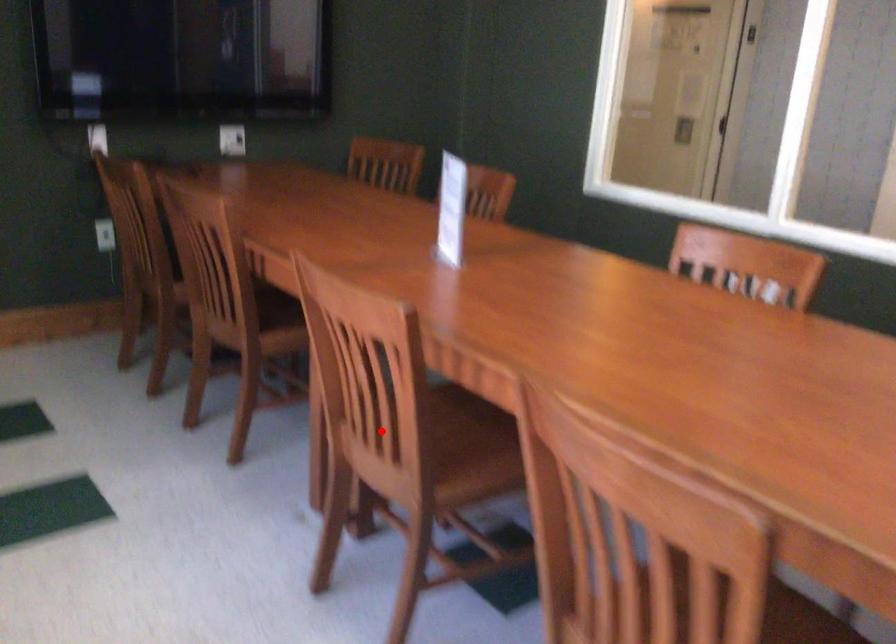
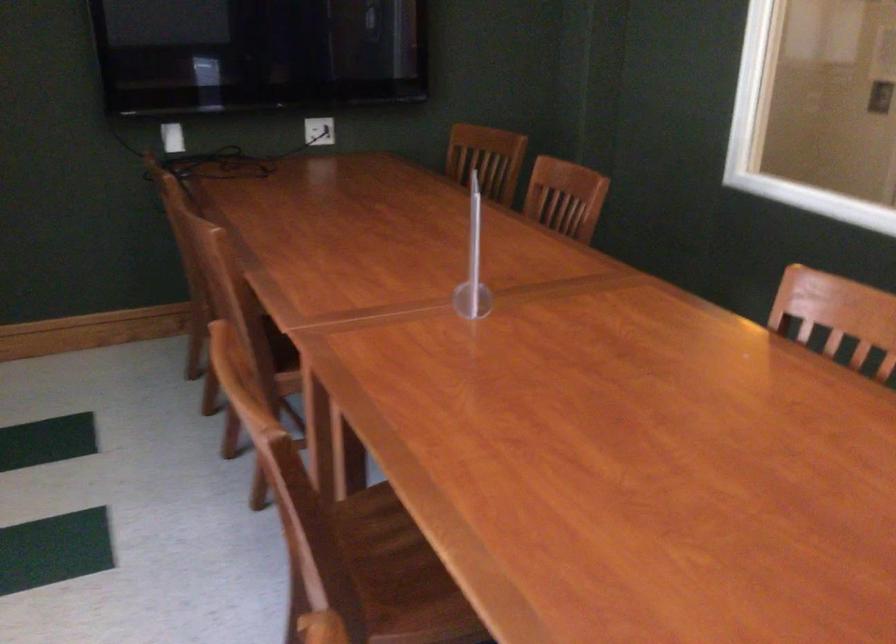
Question: I am providing you with two images of the same scene from different viewpoints. Given a red point in image1, look at the same physical point in image2. Is it:

Choices:
 (A) Closer to the viewpoint
 (B) Farther from the viewpoint

Answer: (A)